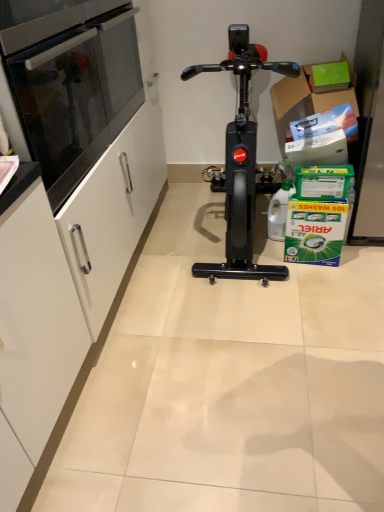
Question: Considering the positions of black glossy stationary bicycle at center and green cardboard box at upper right in the image, is black glossy stationary bicycle at center wider or thinner than green cardboard box at upper right?

Choices:
 (A) thin
 (B) wide

Answer: (B)

Question: Is black glossy stationary bicycle at center taller or shorter than green cardboard box at upper right?

Choices:
 (A) tall
 (B) short

Answer: (A)

Question: Based on their relative distances, which object is farther from the green cardboard box at upper right?

Choices:
 (A) black glossy stationary bicycle at center
 (B) black glass oven at left
 (C) black granite countertop at left

Answer: (C)

Question: Which object is the closest to the black granite countertop at left?

Choices:
 (A) green cardboard box at upper right
 (B) black glossy stationary bicycle at center
 (C) black glass oven at left

Answer: (C)